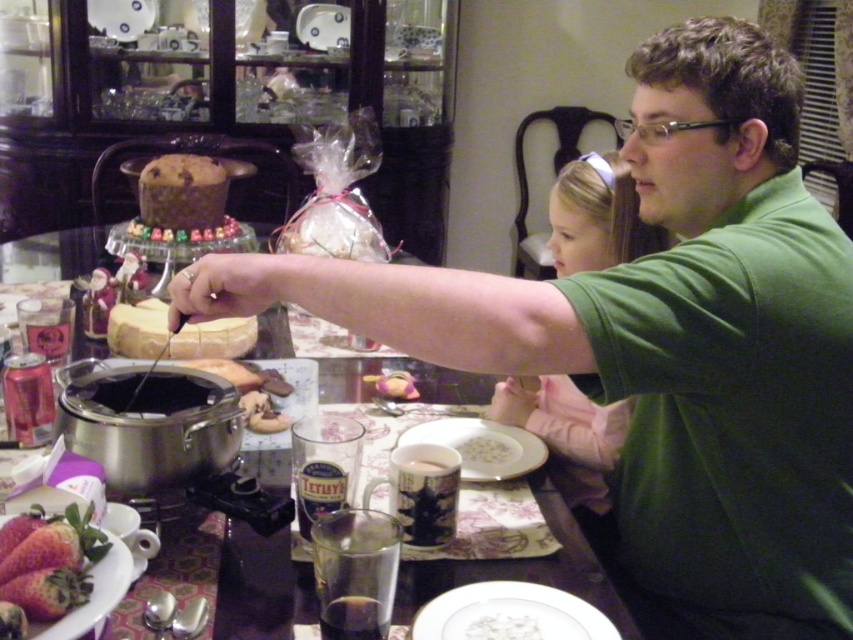
Does point (82, 554) come in front of point (380, 381)?

Yes, point (82, 554) is closer to viewer.

Identify the location of ripe red strawberries at lower left. click(51, 563).

Does white cheese at center come in front of smooth yellow cheese at center?

No, white cheese at center is further to the viewer.

Is white cheese at center to the left of smooth yellow cheese at center from the viewer's perspective?

Indeed, white cheese at center is positioned on the left side of smooth yellow cheese at center.

Is point (157, 323) less distant than point (383, 380)?

No, (157, 323) is behind (383, 380).

Where is `white cheese at center`? The height and width of the screenshot is (640, 853). white cheese at center is located at coordinates (177, 333).

Can you confirm if chocolate cake at center is smaller than white matte plate at center?

No, chocolate cake at center is not smaller than white matte plate at center.

Is chocolate cake at center wider than white matte plate at center?

Indeed, chocolate cake at center has a greater width compared to white matte plate at center.

Between point (193, 204) and point (491, 440), which one is positioned behind?

Positioned behind is point (193, 204).

At what (x,y) coordinates should I click in order to perform the action: click on chocolate cake at center. Please return your answer as a coordinate pair (x, y). The width and height of the screenshot is (853, 640). Looking at the image, I should click on (183, 192).